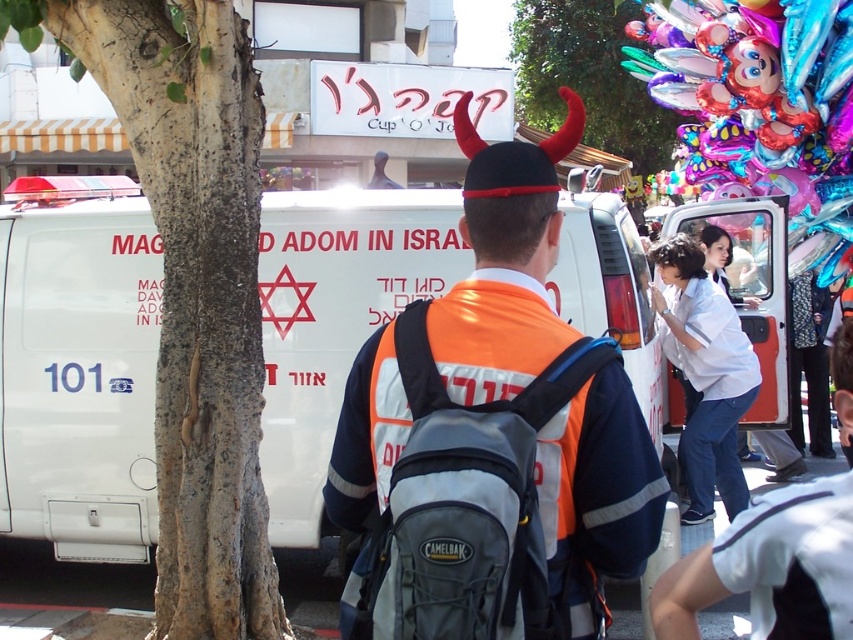
You are a drone operator trying to locate the orange reflective vest at center in a busy street scene. Using the coordinate system where the bottom left corner is the origin, can you confirm if the orange reflective vest at center is located at point (492, 442)?

Yes, the point (492, 442) corresponds to the orange reflective vest at center according to the provided coordinates.

You are a designer creating a size chart for safety gear. You observe the orange reflective vest at center and the white cotton shirt at right in the scene. Which item has a greater width measurement?

The orange reflective vest at center has a greater width measurement than the white cotton shirt at right.